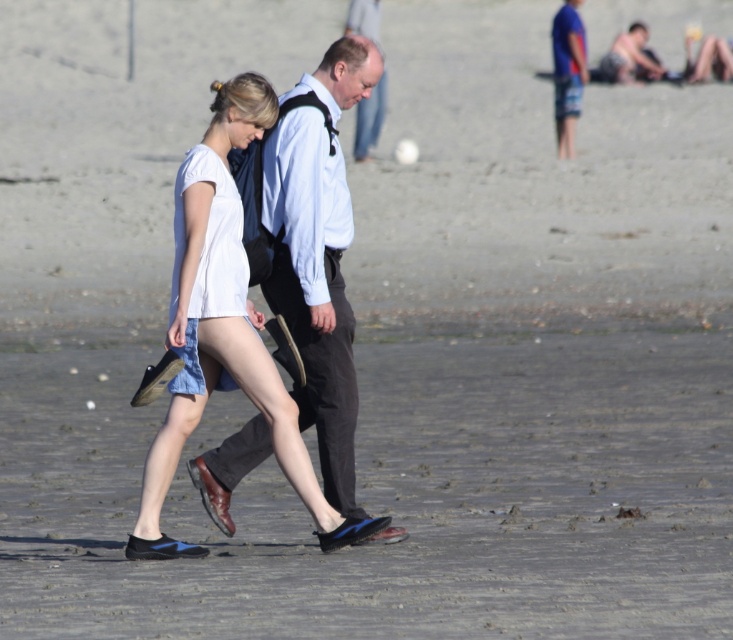
You are a photographer setting up a tripod on the beach. You need to position it so that it doesn t block the view of either the matte black shirt at center or the white denim dress at center. Based on their sizes, which object should you place the tripod closer to?

The matte black shirt at center might be wider than the white denim dress at center, so you should place the tripod closer to the white denim dress at center to avoid blocking it.

You are a photographer standing on the beach and want to take a photo that includes both the white denim dress at center and the blue denim shorts at upper right. Which of the two items will appear larger in the photo?

The white denim dress at center will appear larger in the photo because it is closer to the viewer than the blue denim shorts at upper right.

You are a photographer standing on the beach and want to take a photo of the white denim dress at center and the blue denim shorts at upper right. Which object should you pan your camera to the right to capture?

You should pan your camera to the right to capture the blue denim shorts at upper right because the white denim dress at center is to the left of it.